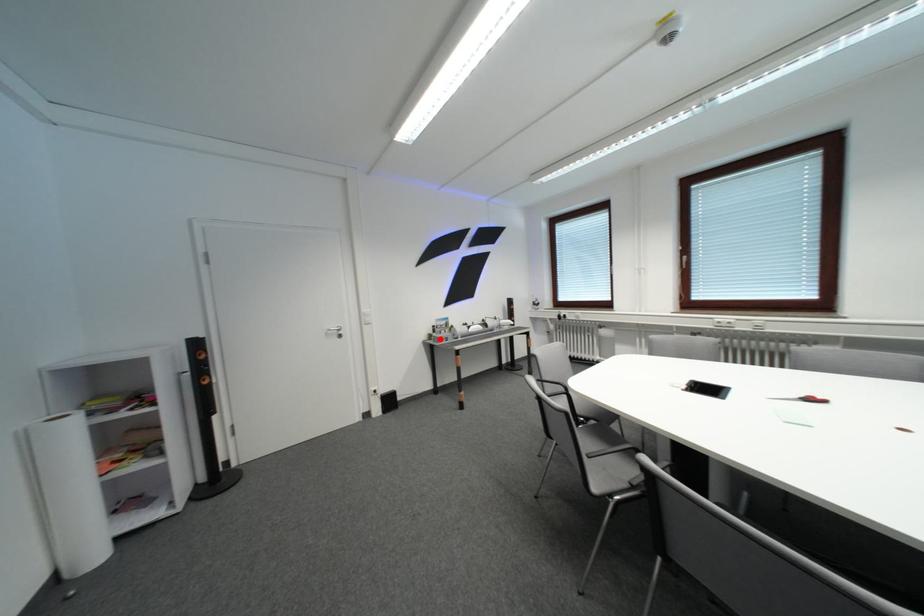
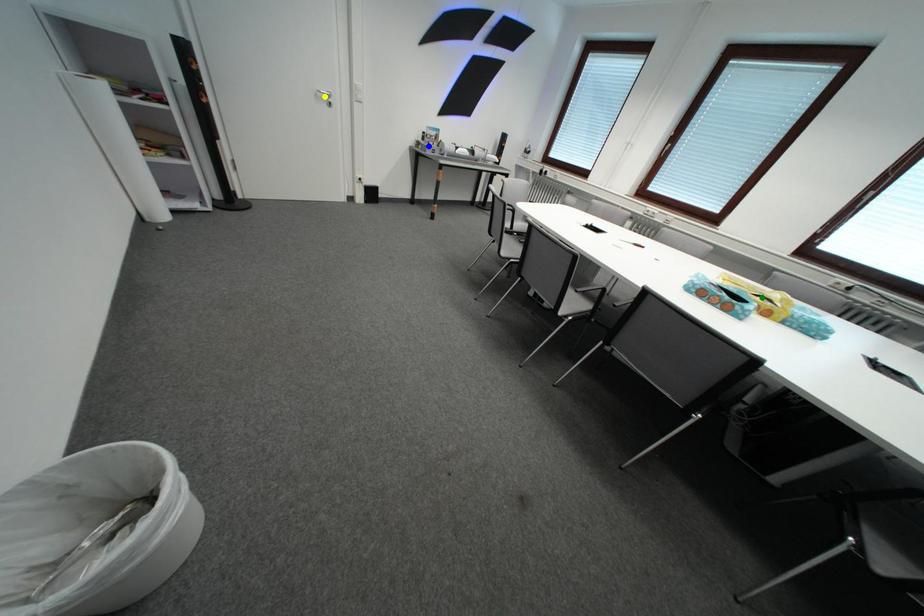
Question: I am providing you with two images of the same scene from different viewpoints. A red point is marked on the first image. You are given multiple points on the second image. Can you choose the point in image 2 that corresponds to the point in image 1?

Choices:
 (A) green point
 (B) yellow point
 (C) blue point

Answer: (C)